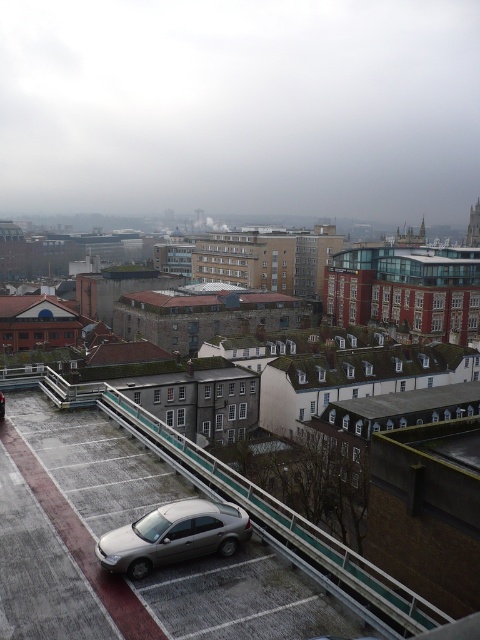
Which of these two, metallic silver car at lower left or satin silver sedan at lower center, stands shorter?

→ satin silver sedan at lower center

The height and width of the screenshot is (640, 480). In order to click on metallic silver car at lower left in this screenshot , I will do `click(243, 600)`.

Who is more forward, [235,588] or [203,532]?

Point [235,588] is more forward.

Image resolution: width=480 pixels, height=640 pixels. Identify the location of metallic silver car at lower left. (243, 600).